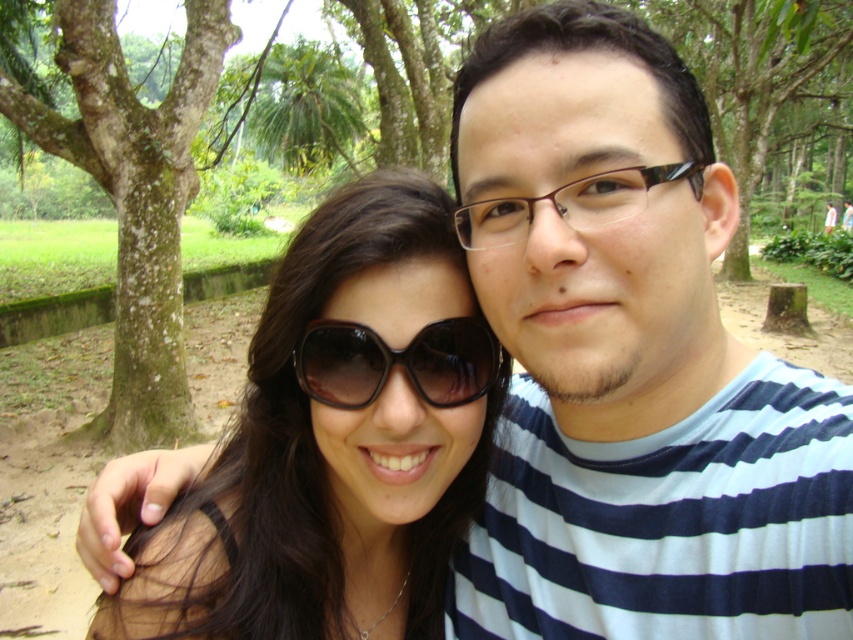
You are a photographer trying to capture a portrait of both individuals. Since you want to highlight their eyewear, you need to know the spatial relationship between the black glossy sunglasses at center and the black plastic glasses at center. Which one is located to the left of the other?

The black glossy sunglasses at center is positioned on the left side of black plastic glasses at center.